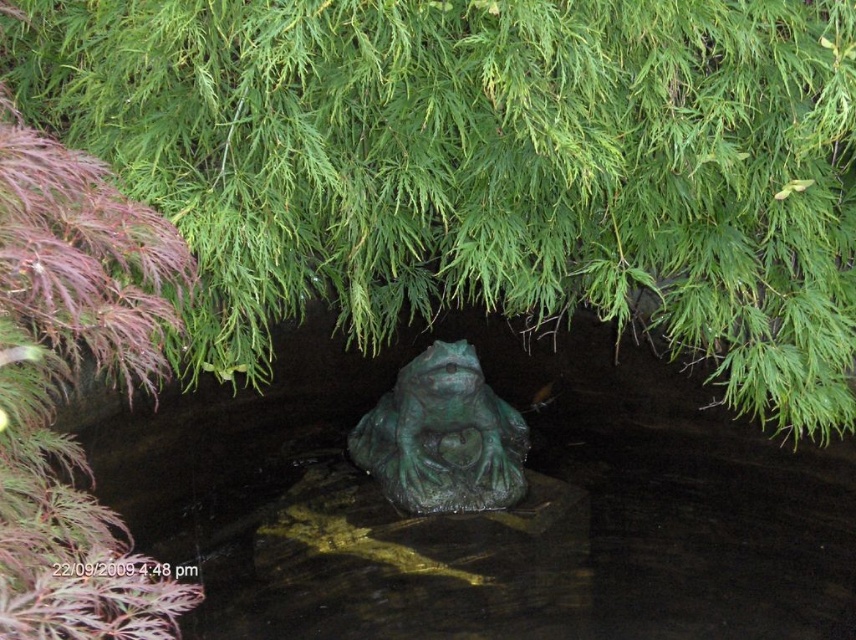
Is green matte tree at center to the left of green patina stone frog at center from the viewer's perspective?

Incorrect, green matte tree at center is not on the left side of green patina stone frog at center.

I want to click on green matte tree at center, so click(486, 168).

Is point (623, 29) farther from viewer compared to point (508, 481)?

No.

Where is `green matte tree at center`? The image size is (856, 640). green matte tree at center is located at coordinates (486, 168).

Between green matte tree at center and purple leafy plant at left, which one is positioned lower?

Positioned lower is purple leafy plant at left.

Where is `green matte tree at center`? The width and height of the screenshot is (856, 640). green matte tree at center is located at coordinates (486, 168).

Where is `green matte tree at center`? The height and width of the screenshot is (640, 856). green matte tree at center is located at coordinates (486, 168).

Consider the image. Can you confirm if purple leafy plant at left is positioned to the left of green patina stone frog at center?

Yes, purple leafy plant at left is to the left of green patina stone frog at center.

This screenshot has height=640, width=856. Describe the element at coordinates (64, 376) in the screenshot. I see `purple leafy plant at left` at that location.

This screenshot has height=640, width=856. In order to click on purple leafy plant at left in this screenshot , I will do `click(64, 376)`.